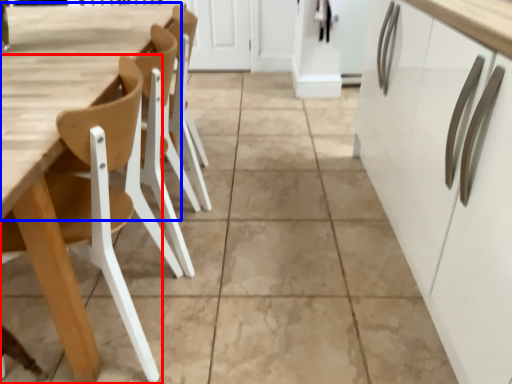
Question: Which object appears closest to the camera in this image, chair (highlighted by a red box) or table (highlighted by a blue box)?

Choices:
 (A) chair
 (B) table

Answer: (A)